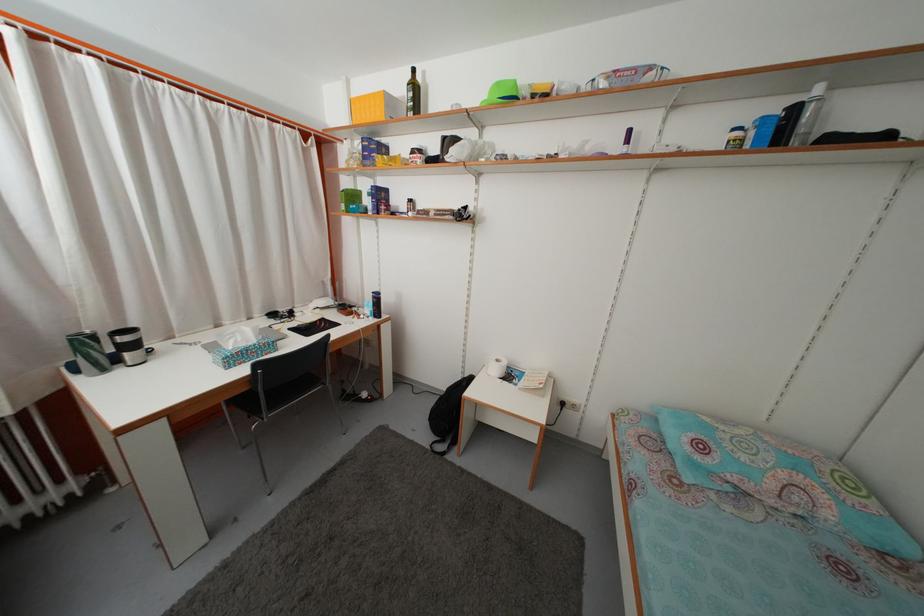
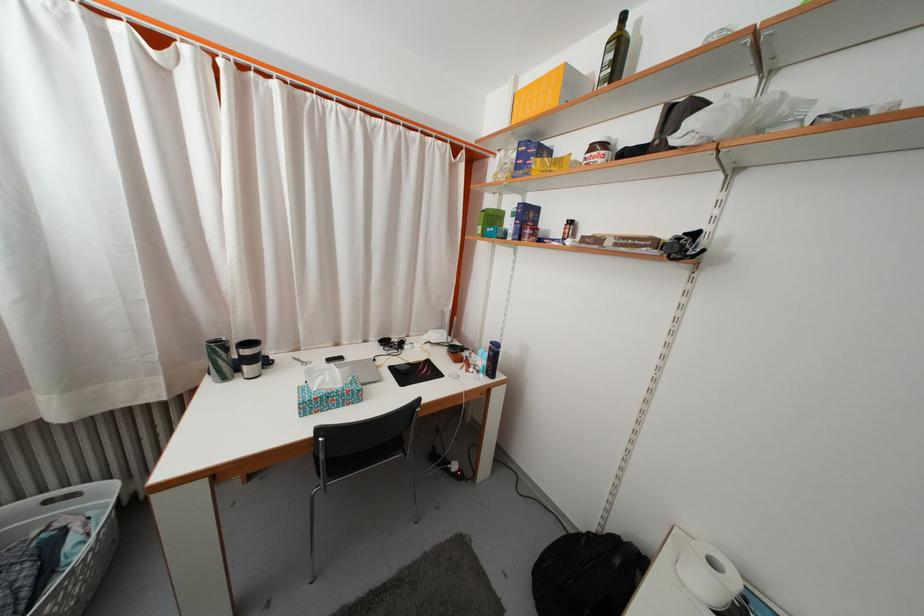
In the second image, find the point that corresponds to point 89,347 in the first image.

(225, 354)